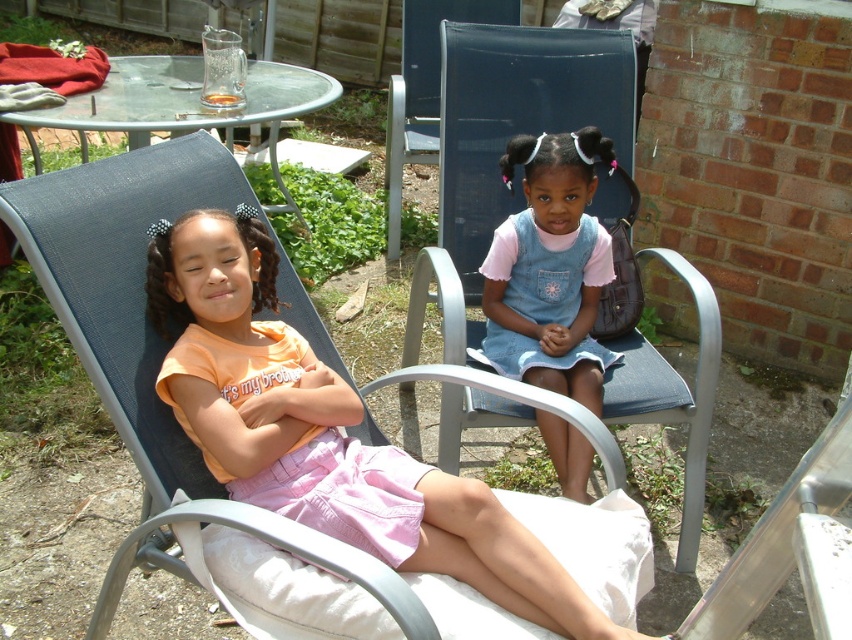
Question: Can you confirm if pink cotton shorts at lower left is positioned below blue fabric chair at upper center?

Choices:
 (A) yes
 (B) no

Answer: (A)

Question: Which of the following is the closest to the observer?

Choices:
 (A) (294, 385)
 (B) (527, 156)

Answer: (A)

Question: Which object appears closest to the camera in this image?

Choices:
 (A) pink cotton shorts at lower left
 (B) blue fabric chair at center
 (C) denim dress at center
 (D) blue fabric chair at upper center

Answer: (A)

Question: Which object is closer to the camera taking this photo?

Choices:
 (A) denim dress at center
 (B) blue fabric chair at center
 (C) pink cotton shorts at lower left
 (D) blue fabric chair at upper center

Answer: (C)

Question: From the image, what is the correct spatial relationship of pink cotton shorts at lower left in relation to denim dress at center?

Choices:
 (A) right
 (B) left

Answer: (B)

Question: Can you confirm if denim dress at center is thinner than blue fabric chair at upper center?

Choices:
 (A) yes
 (B) no

Answer: (A)